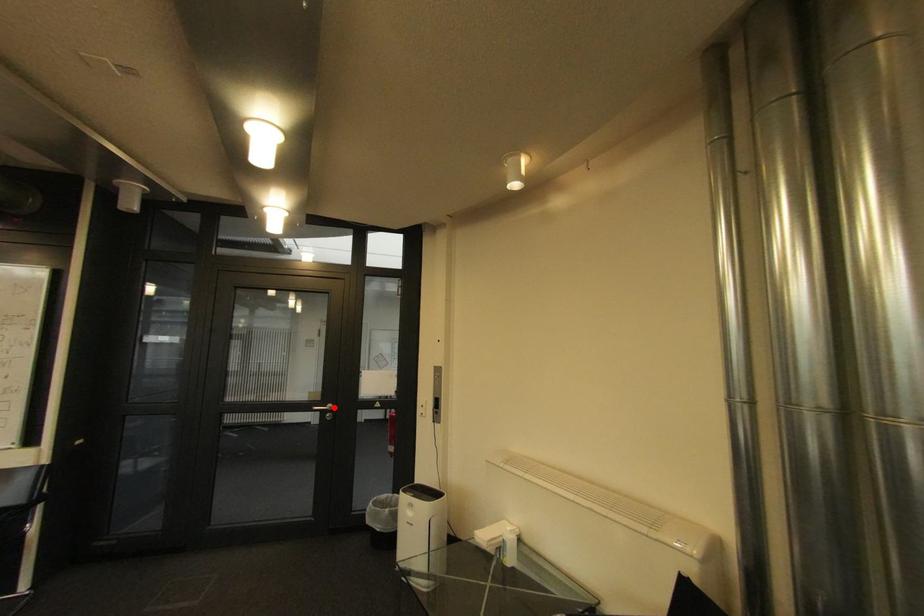
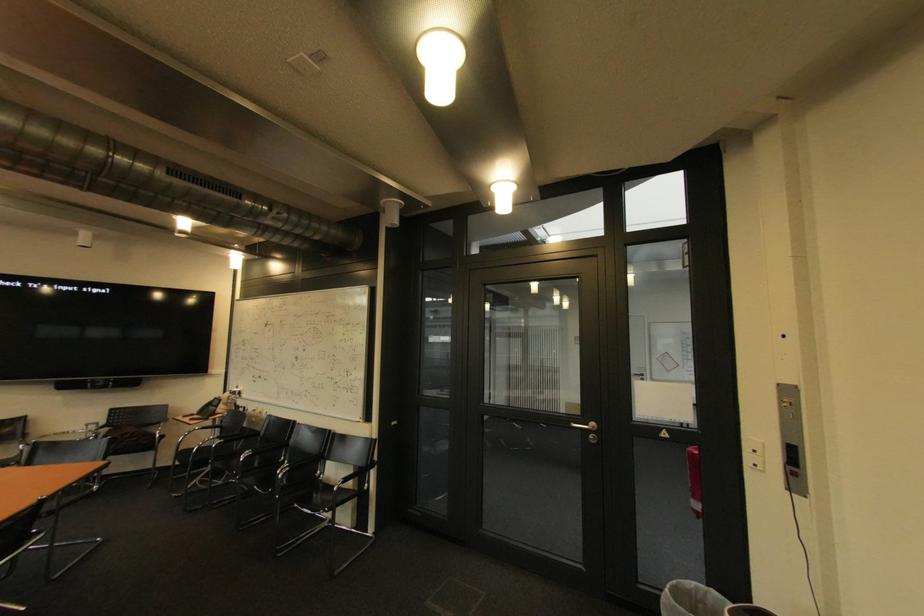
Find the pixel in the second image that matches the highlighted location in the first image.

(596, 426)